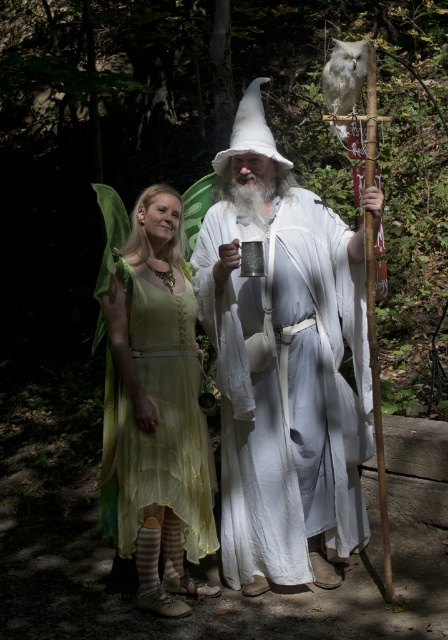
Question: Does white cotton wizard at center have a larger size compared to matte yellow dress at center?

Choices:
 (A) yes
 (B) no

Answer: (A)

Question: Which point is farther to the camera?

Choices:
 (A) (331, 392)
 (B) (160, 492)

Answer: (A)

Question: Which object is farther from the camera taking this photo?

Choices:
 (A) white cotton wizard at center
 (B) matte yellow dress at center

Answer: (B)

Question: Which of the following is the farthest from the observer?

Choices:
 (A) matte yellow dress at center
 (B) white cotton wizard at center

Answer: (A)

Question: Does white cotton wizard at center have a lesser width compared to matte yellow dress at center?

Choices:
 (A) yes
 (B) no

Answer: (B)

Question: In this image, where is white cotton wizard at center located relative to matte yellow dress at center?

Choices:
 (A) below
 (B) above

Answer: (B)